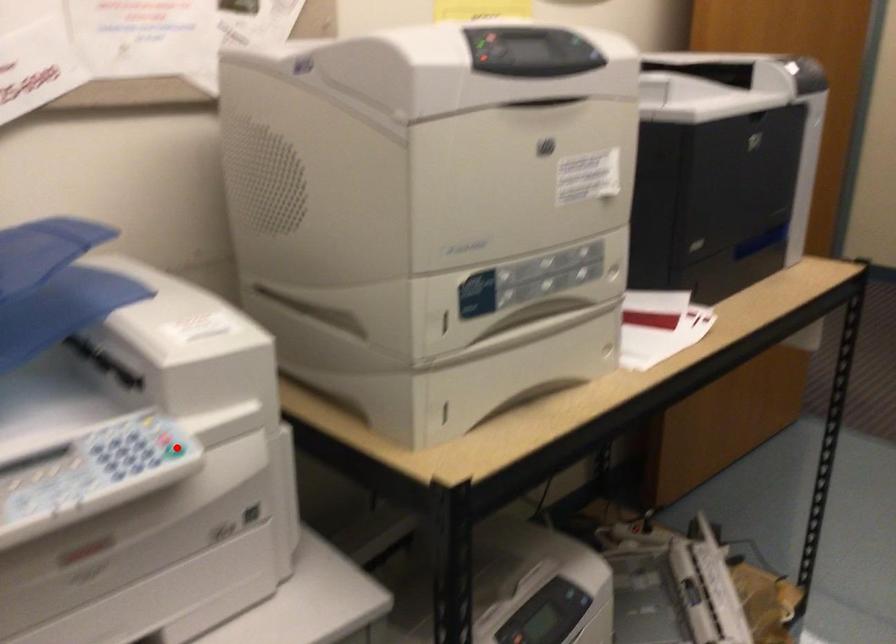
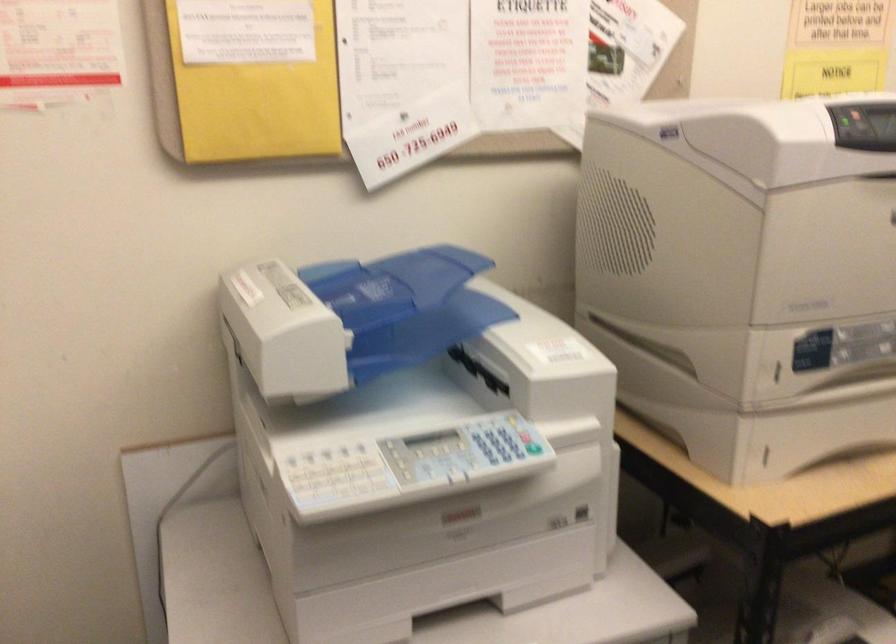
Question: I am providing you with two images of the same scene from different viewpoints. Image1 has a red point marked. In image2, the corresponding 3D location appears at what relative position? Reply with the corresponding letter.

Choices:
 (A) Closer
 (B) Farther

Answer: (B)